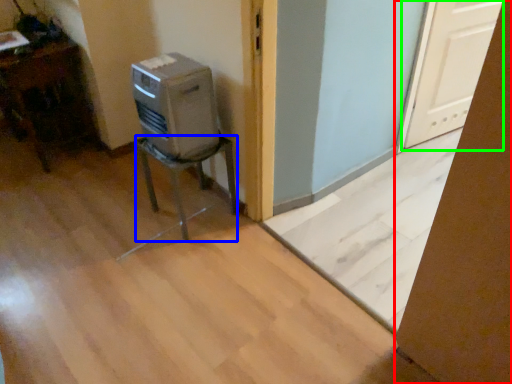
Question: Based on their relative distances, which object is farther from cardboard box (highlighted by a red box)? Choose from furniture (highlighted by a blue box) and screen door (highlighted by a green box).

Choices:
 (A) furniture
 (B) screen door

Answer: (B)